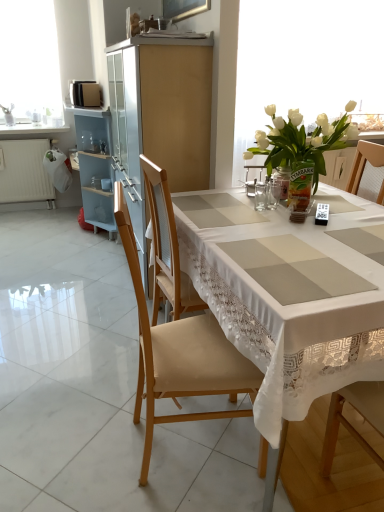
The width and height of the screenshot is (384, 512). Identify the location of free space to the left of translucent glass vase at upper right. (261, 203).